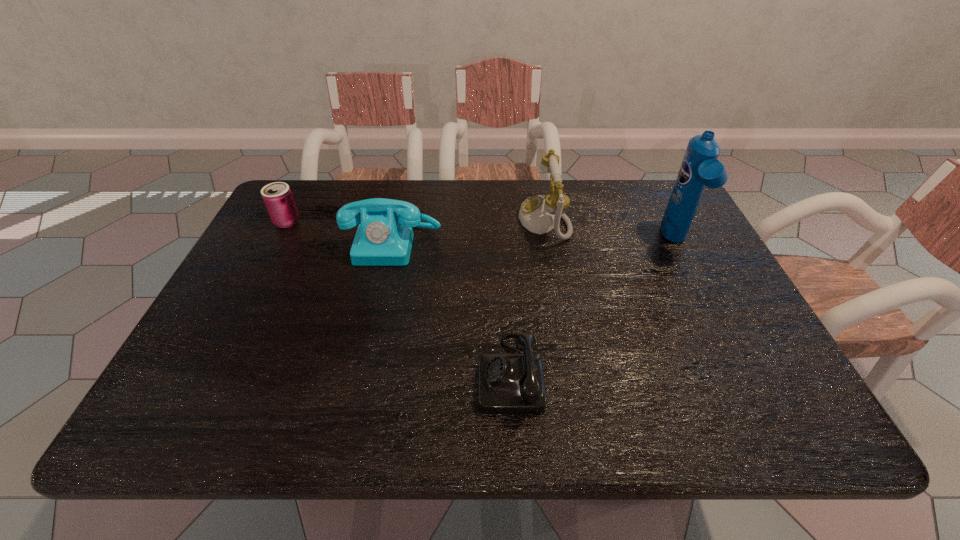
Find the location of a particular element. The height and width of the screenshot is (540, 960). shampoo is located at coordinates (700, 168).

Locate an element on the screen. Image resolution: width=960 pixels, height=540 pixels. the rightmost object is located at coordinates 700,168.

Locate an element on the screen. the tallest telephone is located at coordinates (539, 214).

The height and width of the screenshot is (540, 960). What are the coordinates of `the second tallest telephone` in the screenshot? It's located at point(383,238).

This screenshot has height=540, width=960. What are the coordinates of `the third shortest object` in the screenshot? It's located at (383, 238).

I want to click on can, so click(277, 196).

Identify the location of the shortest telephone. (508, 383).

The height and width of the screenshot is (540, 960). Identify the location of the nearest telephone. (508, 383).

Locate an element on the screen. Image resolution: width=960 pixels, height=540 pixels. vacant region located on the front of the rightmost object is located at coordinates (754, 394).

Locate an element on the screen. This screenshot has height=540, width=960. vacant area situated 0.200m on the dial of the fourth shortest object is located at coordinates (450, 220).